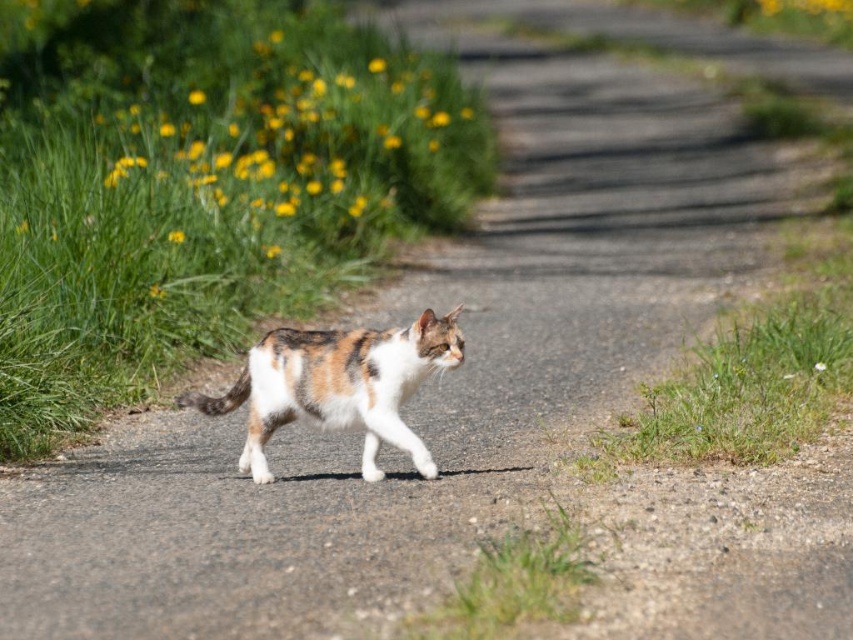
Question: Estimate the real-world distances between objects in this image. Which object is closer to the green grass at center?

Choices:
 (A) white matte flower at center
 (B) calico fur cat at center
 (C) yellow grass at upper left

Answer: (C)

Question: Does green grass at center come behind calico fur cat at center?

Choices:
 (A) yes
 (B) no

Answer: (A)

Question: Among these points, which one is nearest to the camera?

Choices:
 (A) (276, 397)
 (B) (390, 45)
 (C) (128, 227)

Answer: (A)

Question: From the image, what is the correct spatial relationship of green grass at center in relation to yellow grass at upper left?

Choices:
 (A) right
 (B) left

Answer: (B)

Question: Can you confirm if green grass at center is positioned to the right of white matte flower at center?

Choices:
 (A) yes
 (B) no

Answer: (B)

Question: Which point appears closest to the camera in this image?

Choices:
 (A) (189, 77)
 (B) (817, 369)
 (C) (297, 417)
 (D) (358, 44)

Answer: (C)